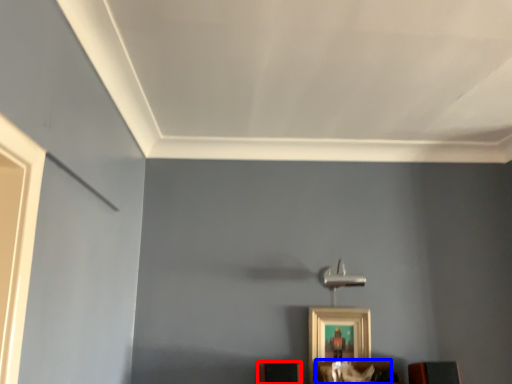
Question: Which of the following is the closest to the observer, furniture (highlighted by a red box) or furniture (highlighted by a blue box)?

Choices:
 (A) furniture
 (B) furniture

Answer: (B)